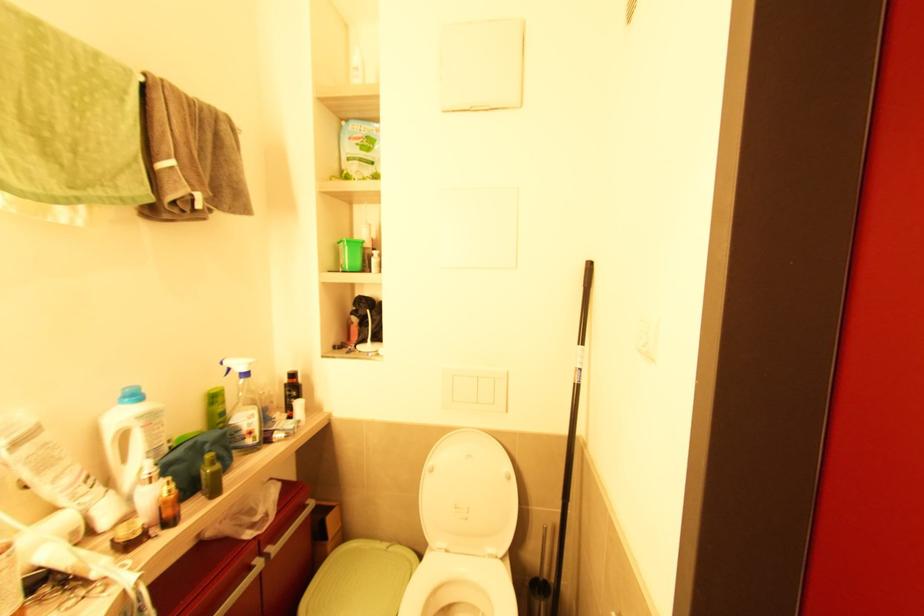
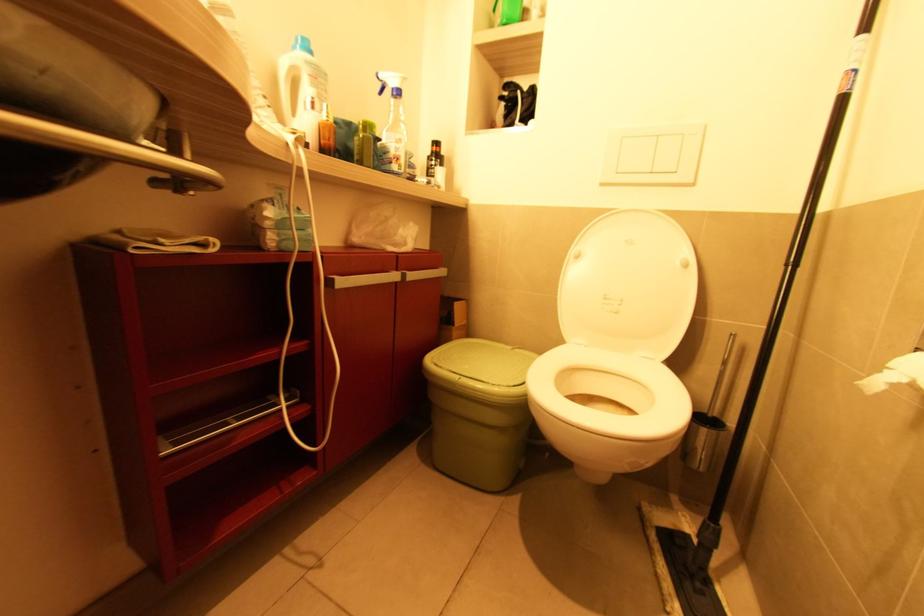
Question: The images are taken continuously from a first-person perspective. In which direction is your viewpoint rotating?

Choices:
 (A) Left
 (B) Right
 (C) Up
 (D) Down

Answer: (A)